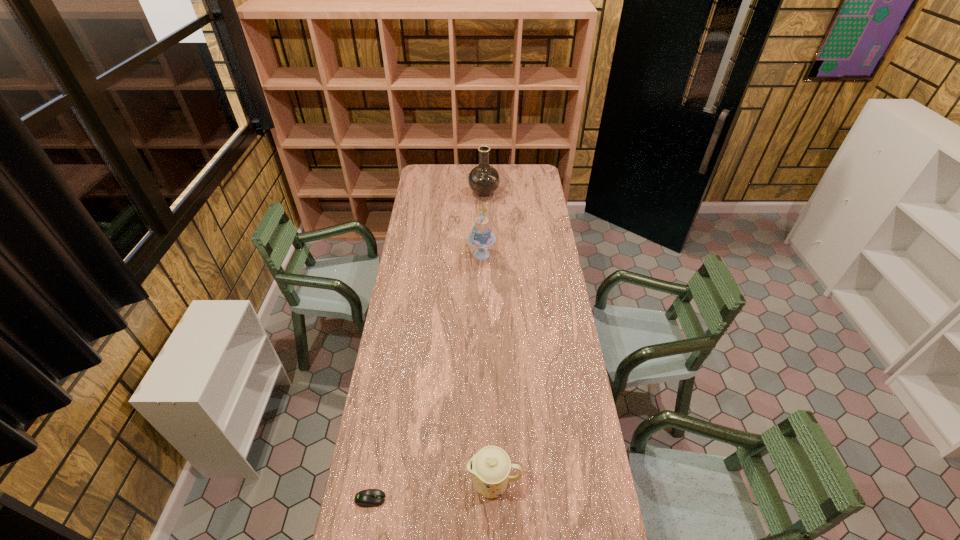
Identify the location of vacant region located 0.270m on the spout of the second shortest object. (385, 483).

Locate an element on the screen. vacant point located on the spout of the second shortest object is located at coordinates (445, 483).

At what (x,y) coordinates should I click in order to perform the action: click on free space located on the wheel side of the leftmost object. Please return your answer as a coordinate pair (x, y). Looking at the image, I should click on (461, 499).

Where is `object positioned at the far edge`? The width and height of the screenshot is (960, 540). object positioned at the far edge is located at coordinates pos(484,179).

The image size is (960, 540). What are the coordinates of `object located at the left edge` in the screenshot? It's located at (367, 498).

In order to click on vacant region at the far edge of the desktop in this screenshot , I will do `click(446, 179)`.

Locate an element on the screen. vacant space at the left edge of the desktop is located at coordinates tap(389, 382).

Identify the location of blank space at the right edge of the desktop. The width and height of the screenshot is (960, 540). (529, 268).

At what (x,y) coordinates should I click in order to perform the action: click on free space at the far left corner of the desktop. Please return your answer as a coordinate pair (x, y). Looking at the image, I should click on (438, 168).

What are the coordinates of `free space at the far right corner of the desktop` in the screenshot? It's located at (527, 170).